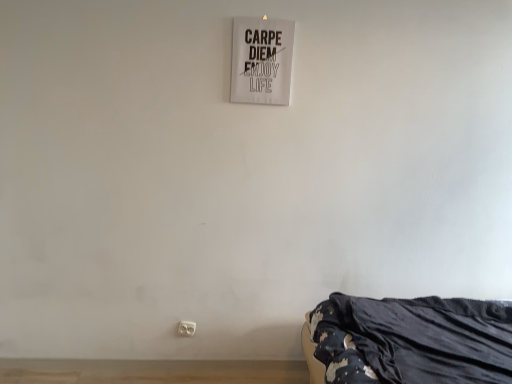
Question: Can you confirm if white plastic electric outlet at lower center is thinner than white paper sign at upper center?

Choices:
 (A) no
 (B) yes

Answer: (A)

Question: From a real-world perspective, is white plastic electric outlet at lower center physically below white paper sign at upper center?

Choices:
 (A) yes
 (B) no

Answer: (A)

Question: Considering the relative sizes of white plastic electric outlet at lower center and white paper sign at upper center in the image provided, is white plastic electric outlet at lower center taller than white paper sign at upper center?

Choices:
 (A) yes
 (B) no

Answer: (B)

Question: Is the position of white plastic electric outlet at lower center more distant than that of white paper sign at upper center?

Choices:
 (A) no
 (B) yes

Answer: (B)

Question: From the image's perspective, is white plastic electric outlet at lower center on top of white paper sign at upper center?

Choices:
 (A) yes
 (B) no

Answer: (B)

Question: Is white paper sign at upper center taller or shorter than black fabric bed at lower right?

Choices:
 (A) tall
 (B) short

Answer: (A)

Question: From a real-world perspective, relative to black fabric bed at lower right, is white paper sign at upper center vertically above or below?

Choices:
 (A) below
 (B) above

Answer: (B)

Question: In the image, is white paper sign at upper center positioned in front of or behind black fabric bed at lower right?

Choices:
 (A) behind
 (B) front

Answer: (A)

Question: Looking at the image, does white paper sign at upper center seem bigger or smaller compared to black fabric bed at lower right?

Choices:
 (A) small
 (B) big

Answer: (A)

Question: In terms of height, does black fabric bed at lower right look taller or shorter compared to white plastic electric outlet at lower center?

Choices:
 (A) short
 (B) tall

Answer: (B)

Question: Considering their positions, is black fabric bed at lower right located in front of or behind white plastic electric outlet at lower center?

Choices:
 (A) behind
 (B) front

Answer: (B)

Question: From the image's perspective, relative to white plastic electric outlet at lower center, is black fabric bed at lower right above or below?

Choices:
 (A) below
 (B) above

Answer: (B)

Question: Visually, is black fabric bed at lower right positioned to the left or to the right of white plastic electric outlet at lower center?

Choices:
 (A) right
 (B) left

Answer: (A)

Question: Does point (182, 329) appear closer or farther from the camera than point (266, 89)?

Choices:
 (A) farther
 (B) closer

Answer: (A)

Question: In the image, is white plastic electric outlet at lower center positioned in front of or behind white paper sign at upper center?

Choices:
 (A) behind
 (B) front

Answer: (A)